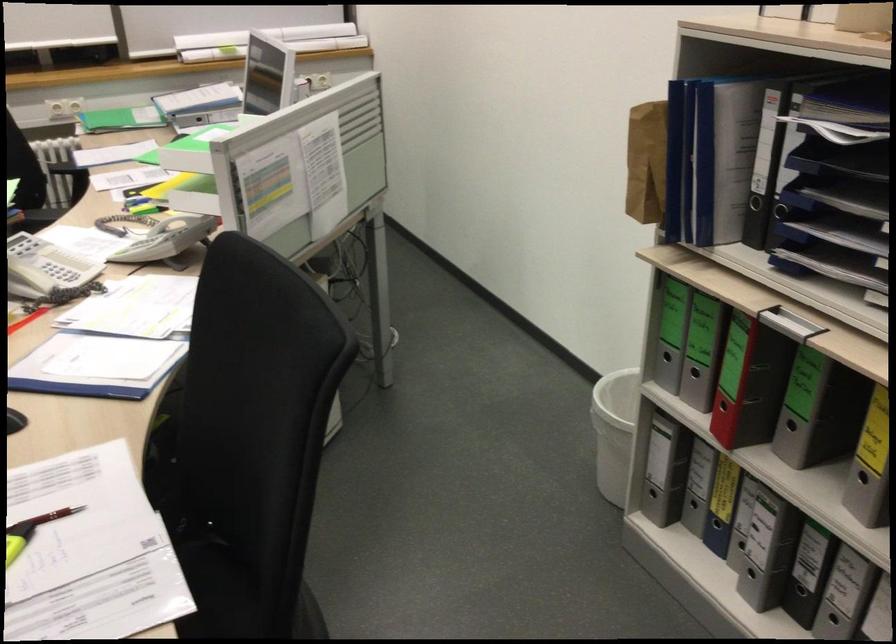
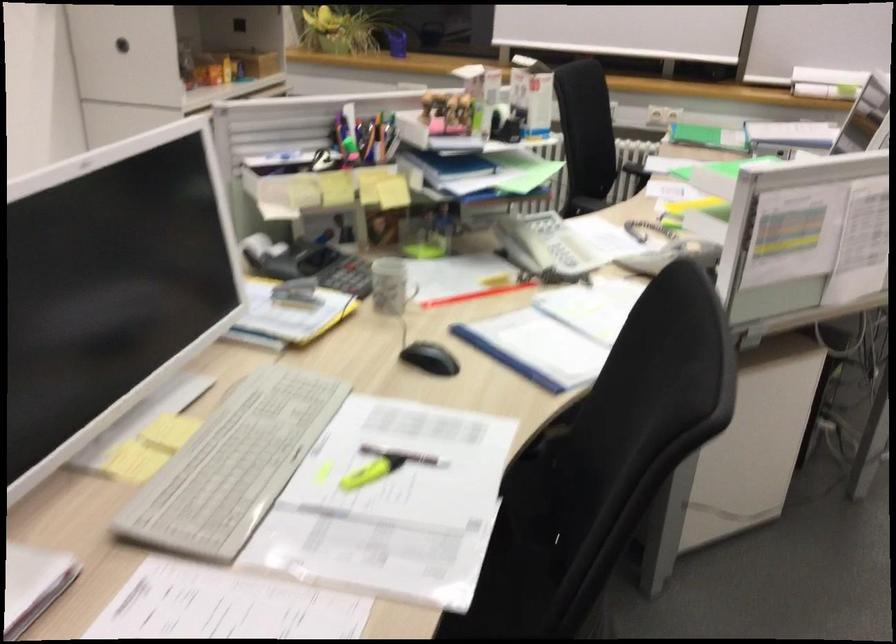
Question: The camera is either moving clockwise (left) or counter-clockwise (right) around the object. The first image is from the beginning of the video and the second image is from the end. Is the camera moving left or right when shooting the video?

Choices:
 (A) Left
 (B) Right

Answer: (B)